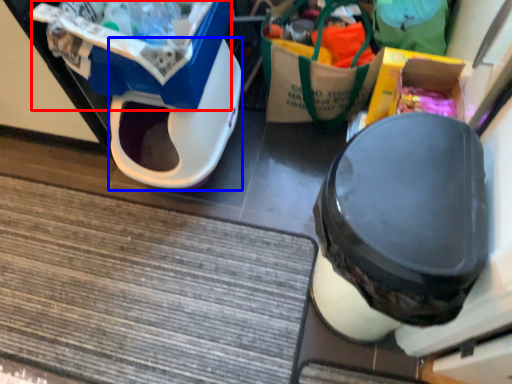
Question: Which point is further to the camera, storage box (highlighted by a red box) or wide (highlighted by a blue box)?

Choices:
 (A) storage box
 (B) wide

Answer: (B)